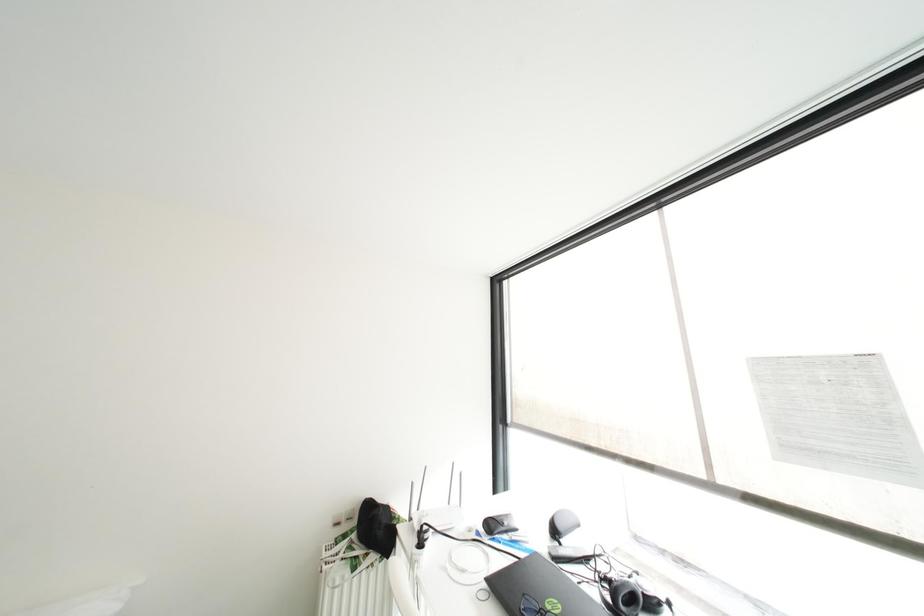
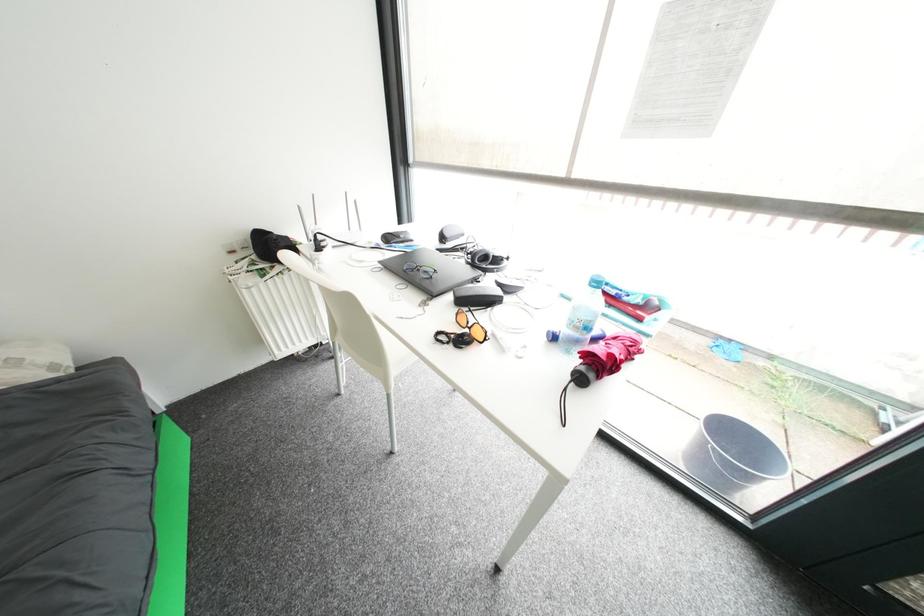
The first image is from the beginning of the video and the second image is from the end. How did the camera likely rotate when shooting the video?

The rotation direction of the camera is right-down.